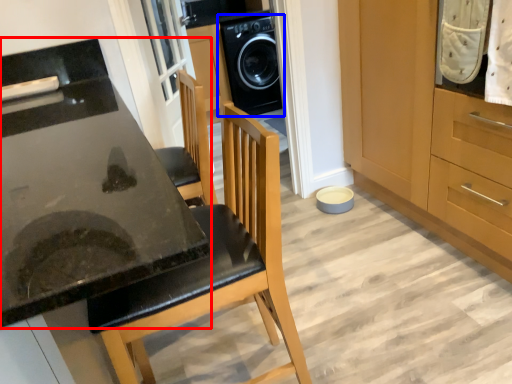
Question: Which object is closer to the camera taking this photo, countertop (highlighted by a red box) or home appliance (highlighted by a blue box)?

Choices:
 (A) countertop
 (B) home appliance

Answer: (A)